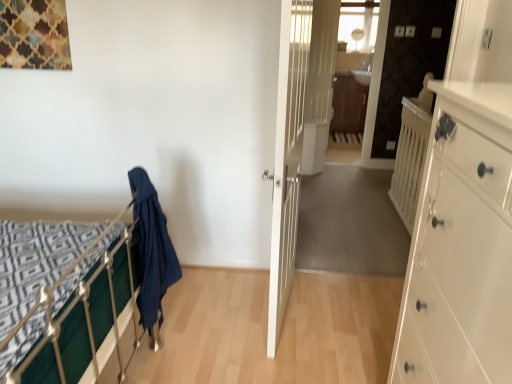
What do you see at coordinates (411, 156) in the screenshot?
I see `white wooden balustrade at right` at bounding box center [411, 156].

Locate an element on the screen. Image resolution: width=512 pixels, height=384 pixels. white glossy chest of drawers at right is located at coordinates (461, 245).

Locate an element on the screen. Image resolution: width=512 pixels, height=384 pixels. white glossy door at center, marked as the 1th door in a back-to-front arrangement is located at coordinates (319, 84).

Find the location of a particular element. Image resolution: width=512 pixels, height=384 pixels. brown wood/file cabinet at center is located at coordinates (348, 105).

Based on their positions, is white glossy door at center, marked as the 1th door in a back-to-front arrangement, located to the left or right of white glossy chest of drawers at right?

white glossy door at center, marked as the 1th door in a back-to-front arrangement, is to the right of white glossy chest of drawers at right.

From the image's perspective, who appears lower, white glossy door at center, the second door when ordered from front to back, or white glossy chest of drawers at right?

white glossy chest of drawers at right is shown below in the image.

Is white glossy door at center, the second door when ordered from front to back, facing away from white glossy chest of drawers at right?

No, white glossy door at center, the second door when ordered from front to back,'s orientation is not away from white glossy chest of drawers at right.

Who is bigger, white glossy chest of drawers at right or white wooden balustrade at right?

With larger size is white glossy chest of drawers at right.

Between white glossy chest of drawers at right and white wooden balustrade at right, which one appears on the left side from the viewer's perspective?

From the viewer's perspective, white glossy chest of drawers at right appears more on the left side.

Could you tell me if white glossy chest of drawers at right is turned towards white wooden balustrade at right?

No, white glossy chest of drawers at right does not turn towards white wooden balustrade at right.

How many degrees apart are the facing directions of white glossy chest of drawers at right and white wooden balustrade at right?

The facing directions of white glossy chest of drawers at right and white wooden balustrade at right are 0.479 degrees apart.

Is dark blue fabric at left touching white glossy chest of drawers at right?

No.

You are a GUI agent. You are given a task and a screenshot of the screen. Output one action in this format:
    pyautogui.click(x=<x>, y=<y>)
    Task: Click on the chest of drawers to the right of dark blue fabric at left
    This screenshot has height=384, width=512.
    Given the screenshot: What is the action you would take?
    pyautogui.click(x=461, y=245)

In the scene shown: Which is closer to the camera, [153,293] or [498,165]?

The point [498,165] is more forward.

From the image's perspective, is dark blue fabric at left located above or below white glossy chest of drawers at right?

Clearly, from the image's perspective, dark blue fabric at left is above white glossy chest of drawers at right.

Does point (166, 277) come closer to viewer compared to point (408, 174)?

Yes, it is.

Looking at this image, from a real-world perspective, which object rests below the other?

dark blue fabric at left.

Are dark blue fabric at left and white wooden balustrade at right beside each other?

No.

Between dark blue fabric at left and white wooden balustrade at right, which one has less height?

Standing shorter between the two is dark blue fabric at left.

Consider the image. Do you think brown wood/file cabinet at center is within dark blue fabric at left, or outside of it?

brown wood/file cabinet at center is located beyond the bounds of dark blue fabric at left.

Considering the sizes of objects brown wood/file cabinet at center and dark blue fabric at left in the image provided, who is smaller, brown wood/file cabinet at center or dark blue fabric at left?

Smaller between the two is dark blue fabric at left.

From the image's perspective, is brown wood/file cabinet at center located above or below dark blue fabric at left?

From the image's perspective, brown wood/file cabinet at center appears above dark blue fabric at left.

Which of these two, brown wood/file cabinet at center or dark blue fabric at left, is thinner?

With smaller width is dark blue fabric at left.

Is white glossy door at center, the second door when ordered from front to back, aimed at brown wood/file cabinet at center?

No, white glossy door at center, the second door when ordered from front to back, is not facing towards brown wood/file cabinet at center.

Is white glossy door at center, marked as the 1th door in a back-to-front arrangement, wider than brown wood/file cabinet at center?

No.

Is point (321, 51) closer or farther from the camera than point (335, 125)?

Point (321, 51) is closer to the camera than point (335, 125).

Considering the sizes of white glossy door at center, which appears as the 2th door when viewed from the left, and brown wood/file cabinet at center in the image, is white glossy door at center, which appears as the 2th door when viewed from the left, taller or shorter than brown wood/file cabinet at center?

Considering their sizes, white glossy door at center, which appears as the 2th door when viewed from the left, has more height than brown wood/file cabinet at center.

Who is smaller, white wooden door at center, which appears as the 1th door when viewed from the left, or white glossy door at center, marked as the 1th door in a back-to-front arrangement?

With smaller size is white glossy door at center, marked as the 1th door in a back-to-front arrangement.

How many degrees apart are the facing directions of white wooden door at center, which is the second door in back-to-front order, and white glossy door at center, which appears as the 2th door when viewed from the left?

The angle between the facing direction of white wooden door at center, which is the second door in back-to-front order, and the facing direction of white glossy door at center, which appears as the 2th door when viewed from the left, is 23 degrees.

Is white wooden door at center, which is the second door in back-to-front order, far away from white glossy door at center, the 1th door when ordered from right to left?

No, white wooden door at center, which is the second door in back-to-front order, is not far from white glossy door at center, the 1th door when ordered from right to left.

Identify the location of door in front of the white glossy door at center, the 1th door when ordered from right to left. This screenshot has height=384, width=512. click(297, 133).

Find the location of a particular element. the 2nd door above the white glossy chest of drawers at right (from the image's perspective) is located at coordinates (319, 84).

Locate an element on the screen. The image size is (512, 384). balustrade to the right of white glossy chest of drawers at right is located at coordinates (411, 156).

Estimate the real-world distances between objects in this image. Which object is further from brown wood/file cabinet at center, white wooden balustrade at right or white glossy door at center, which appears as the 2th door when viewed from the left?

The object further to brown wood/file cabinet at center is white wooden balustrade at right.

Which object lies nearer to the anchor point white wooden balustrade at right, brown wood/file cabinet at center or white glossy chest of drawers at right?

white glossy chest of drawers at right is positioned closer to the anchor white wooden balustrade at right.

Considering their positions, is white wooden balustrade at right positioned closer to white wooden door at center, positioned as the 1th door in front-to-back order, than white glossy door at center, the second door when ordered from front to back?

The object closer to white wooden door at center, positioned as the 1th door in front-to-back order, is white glossy door at center, the second door when ordered from front to back.

Based on the photo, estimate the real-world distances between objects in this image. Which object is closer to dark blue fabric at left, brown wood/file cabinet at center or white glossy chest of drawers at right?

white glossy chest of drawers at right lies closer to dark blue fabric at left than the other object.

Estimate the real-world distances between objects in this image. Which object is further from white wooden door at center, which appears as the 1th door when viewed from the left, brown wood/file cabinet at center or white glossy chest of drawers at right?

white glossy chest of drawers at right is further to white wooden door at center, which appears as the 1th door when viewed from the left.

Looking at the image, which one is located further to white glossy door at center, marked as the 1th door in a back-to-front arrangement, white glossy chest of drawers at right or white wooden balustrade at right?

white glossy chest of drawers at right.

Estimate the real-world distances between objects in this image. Which object is closer to brown wood/file cabinet at center, white glossy chest of drawers at right or dark blue fabric at left?

Among the two, dark blue fabric at left is located nearer to brown wood/file cabinet at center.

From the image, which object appears to be nearer to brown wood/file cabinet at center, dark blue fabric at left or white glossy chest of drawers at right?

dark blue fabric at left lies closer to brown wood/file cabinet at center than the other object.

Where is `door located between white wooden balustrade at right and brown wood/file cabinet at center in the depth direction`? The height and width of the screenshot is (384, 512). door located between white wooden balustrade at right and brown wood/file cabinet at center in the depth direction is located at coordinates (319, 84).

You are a GUI agent. You are given a task and a screenshot of the screen. Output one action in this format:
    pyautogui.click(x=<x>, y=<y>)
    Task: Click on the door located between dark blue fabric at left and brown wood/file cabinet at center in the depth direction
    
    Given the screenshot: What is the action you would take?
    pyautogui.click(x=319, y=84)

Find the location of `door between white glossy chest of drawers at right and white glossy door at center, the 1th door when ordered from right to left, along the z-axis`. door between white glossy chest of drawers at right and white glossy door at center, the 1th door when ordered from right to left, along the z-axis is located at coordinates (297, 133).

Find the location of a particular element. cloth between white glossy chest of drawers at right and white glossy door at center, marked as the 1th door in a back-to-front arrangement, along the z-axis is located at coordinates (152, 249).